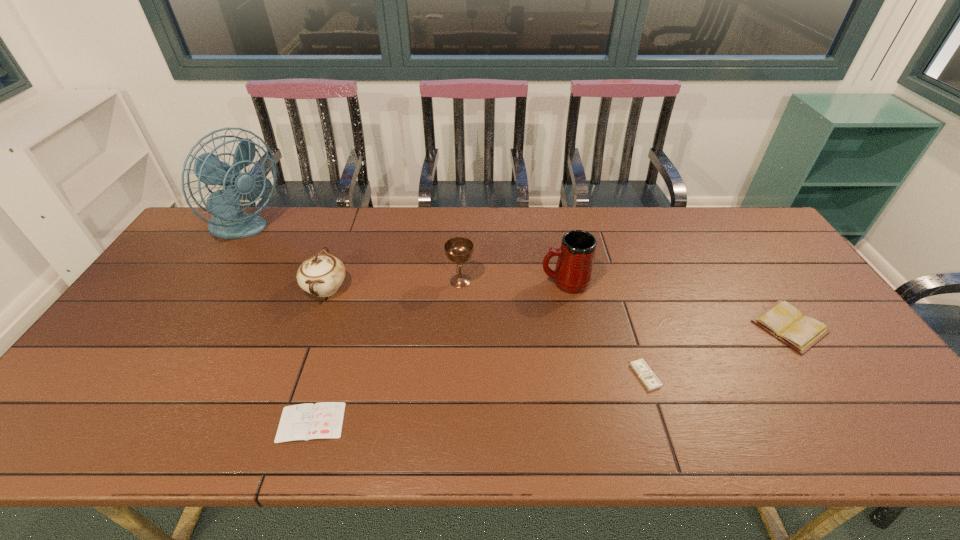
You are a GUI agent. You are given a task and a screenshot of the screen. Output one action in this format:
    pyautogui.click(x=<x>, y=<y>)
    Task: Click on the vacant space at the far right corner
    This screenshot has height=540, width=960.
    Given the screenshot: What is the action you would take?
    pyautogui.click(x=768, y=239)

This screenshot has height=540, width=960. Find the location of `free space between the shortest object and the tallest object`. free space between the shortest object and the tallest object is located at coordinates (278, 327).

I want to click on free space between the chalice and the leftmost object, so click(352, 256).

At what (x,y) coordinates should I click in order to perform the action: click on unoccupied area between the mug and the third shortest object. Please return your answer as a coordinate pair (x, y). Image resolution: width=960 pixels, height=540 pixels. Looking at the image, I should click on (678, 305).

Image resolution: width=960 pixels, height=540 pixels. In order to click on vacant point located between the left diary and the chinaware in this screenshot , I will do `click(319, 355)`.

Locate an element on the screen. The height and width of the screenshot is (540, 960). empty location between the chalice and the farther diary is located at coordinates (625, 304).

Where is `empty space that is in between the nearest object and the second nearest object`? empty space that is in between the nearest object and the second nearest object is located at coordinates (478, 399).

The width and height of the screenshot is (960, 540). Identify the location of free area in between the fan and the sixth object from left to right. (445, 303).

Locate an element on the screen. The width and height of the screenshot is (960, 540). vacant space in between the fourth object from left to right and the chinaware is located at coordinates (394, 285).

Identify the location of free spot between the sixth object from left to right and the chinaware. (486, 332).